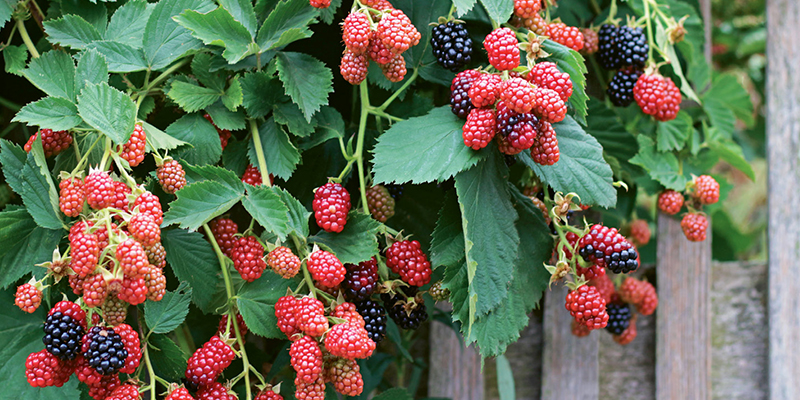
Locate an element on the screen. vertical planks is located at coordinates (778, 212), (685, 355), (578, 369), (461, 376).